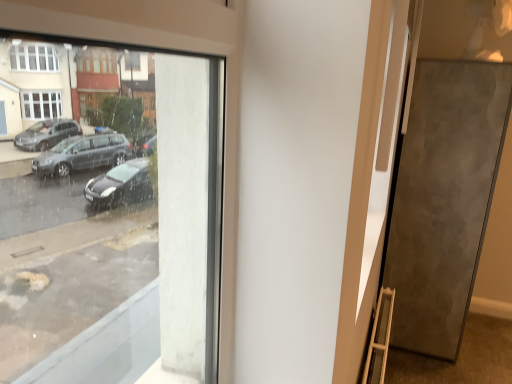
Question: Is matte gray door at right positioned before metallic gray pavement at lower right?

Choices:
 (A) yes
 (B) no

Answer: (B)

Question: Is matte gray door at right facing towards metallic gray pavement at lower right?

Choices:
 (A) yes
 (B) no

Answer: (B)

Question: Is matte gray door at right turned away from metallic gray pavement at lower right?

Choices:
 (A) yes
 (B) no

Answer: (B)

Question: Can you confirm if matte gray door at right is thinner than metallic gray pavement at lower right?

Choices:
 (A) yes
 (B) no

Answer: (A)

Question: From the image's perspective, would you say matte gray door at right is shown under metallic gray pavement at lower right?

Choices:
 (A) yes
 (B) no

Answer: (B)

Question: Can you confirm if matte gray door at right is wider than metallic gray pavement at lower right?

Choices:
 (A) yes
 (B) no

Answer: (B)

Question: Considering the relative sizes of metallic gray pavement at lower right and matte gray door at right in the image provided, is metallic gray pavement at lower right wider than matte gray door at right?

Choices:
 (A) no
 (B) yes

Answer: (B)

Question: Could you tell me if metallic gray pavement at lower right is facing matte gray door at right?

Choices:
 (A) no
 (B) yes

Answer: (A)

Question: Is metallic gray pavement at lower right behind matte gray door at right?

Choices:
 (A) no
 (B) yes

Answer: (A)

Question: Is metallic gray pavement at lower right positioned with its back to matte gray door at right?

Choices:
 (A) no
 (B) yes

Answer: (A)

Question: Is metallic gray pavement at lower right positioned before matte gray door at right?

Choices:
 (A) yes
 (B) no

Answer: (A)

Question: From a real-world perspective, is metallic gray pavement at lower right on matte gray door at right?

Choices:
 (A) yes
 (B) no

Answer: (B)

Question: Is wooden ladder at lower right located outside matte gray door at right?

Choices:
 (A) no
 (B) yes

Answer: (B)